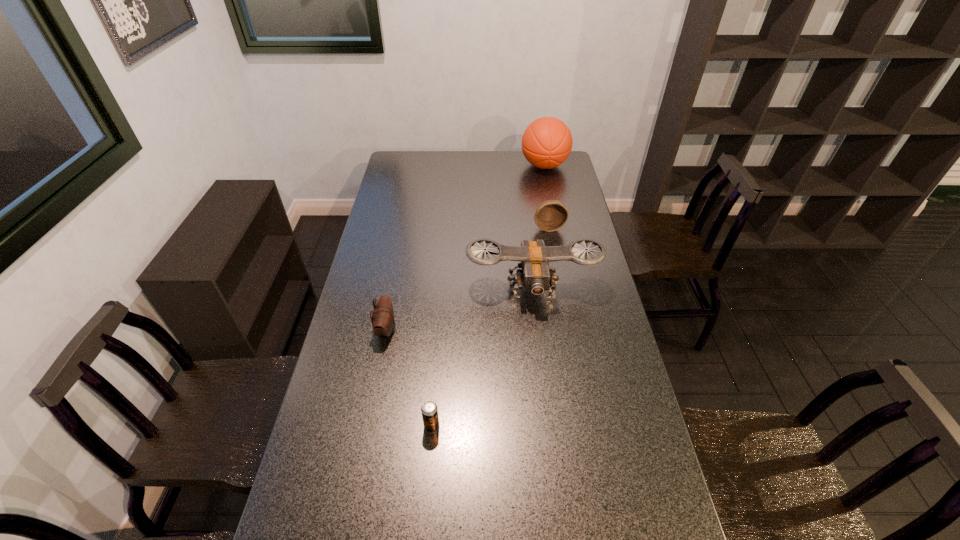
The image size is (960, 540). In order to click on basketball in this screenshot , I will do `click(547, 142)`.

Identify the location of the farthest object. This screenshot has width=960, height=540. (547, 142).

The image size is (960, 540). I want to click on drone, so click(535, 275).

In order to click on the third farthest object in this screenshot , I will do `click(535, 275)`.

Find the location of `bowl`. bowl is located at coordinates (551, 215).

What are the coordinates of `the fourth nearest object` in the screenshot? It's located at (551, 215).

Locate an element on the screen. the leftmost object is located at coordinates (383, 320).

Where is `pouch`? The image size is (960, 540). pouch is located at coordinates (383, 320).

Find the location of a particular element. The image size is (960, 540). the nearest object is located at coordinates (429, 410).

Locate an element on the screen. The image size is (960, 540). beer can is located at coordinates (429, 410).